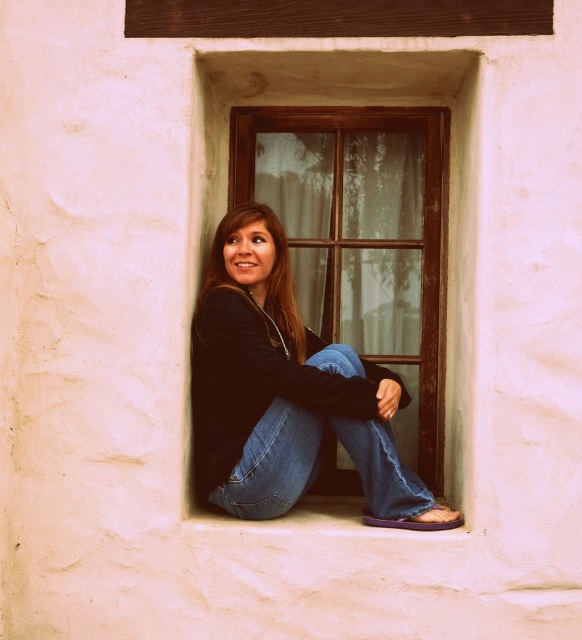
Which is above, jeans at center or denim jeans at center?

jeans at center is above.

Does jeans at center come behind denim jeans at center?

No, it is in front of denim jeans at center.

Locate an element on the screen. jeans at center is located at coordinates (286, 392).

This screenshot has width=582, height=640. Identify the location of jeans at center. (286, 392).

Between jeans at center and smooth black hoodie at center, which one appears on the right side from the viewer's perspective?

jeans at center is more to the right.

How far apart are jeans at center and smooth black hoodie at center?

jeans at center and smooth black hoodie at center are 8.05 inches apart from each other.

At what (x,y) coordinates should I click in order to perform the action: click on jeans at center. Please return your answer as a coordinate pair (x, y). The width and height of the screenshot is (582, 640). Looking at the image, I should click on (286, 392).

Find the location of a particular element. Image resolution: width=582 pixels, height=640 pixels. jeans at center is located at coordinates (286, 392).

Is denim jeans at center smaller than smooth black hoodie at center?

Incorrect, denim jeans at center is not smaller in size than smooth black hoodie at center.

Is denim jeans at center closer to camera compared to smooth black hoodie at center?

Yes, it is in front of smooth black hoodie at center.

Which is behind, point (321, 349) or point (221, 227)?

The point (221, 227) is more distant.

Where is `denim jeans at center`? denim jeans at center is located at coordinates click(317, 465).